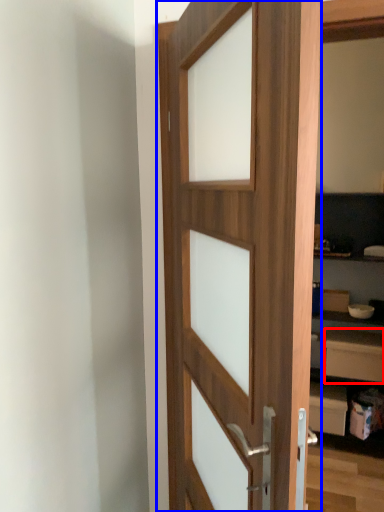
Question: Which object appears closest to the camera in this image, drawer (highlighted by a red box) or door (highlighted by a blue box)?

Choices:
 (A) drawer
 (B) door

Answer: (B)